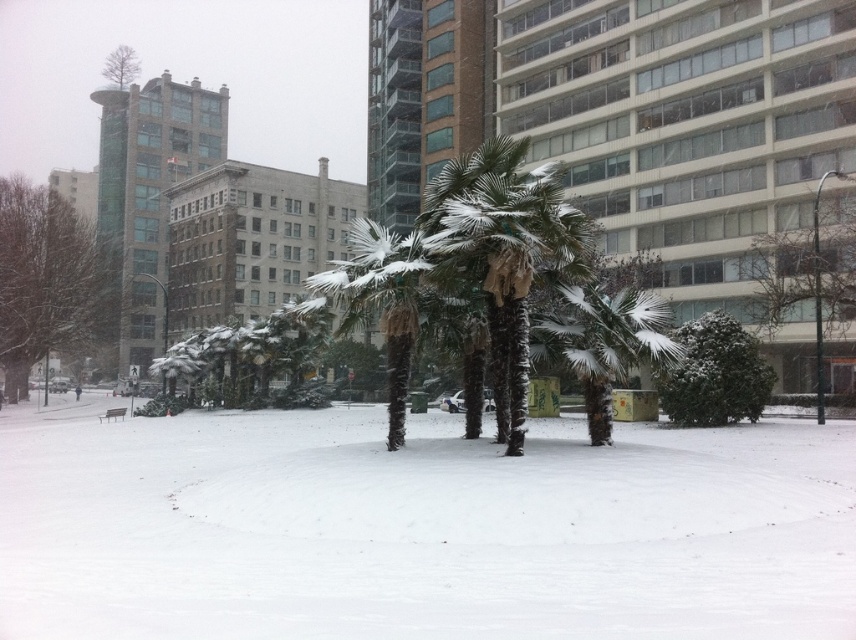
Question: Which of the following is the closest to the observer?

Choices:
 (A) (720, 378)
 (B) (518, 218)
 (C) (186, 536)

Answer: (C)

Question: Considering the relative positions of white fluffy snow at center and green leafy tree at left in the image provided, where is white fluffy snow at center located with respect to green leafy tree at left?

Choices:
 (A) left
 (B) right

Answer: (B)

Question: Among these objects, which one is farthest from the camera?

Choices:
 (A) green textured palm tree at center
 (B) green leafy tree at left
 (C) snow-covered palm trees at center

Answer: (B)

Question: Can you confirm if snow-covered palm trees at center is thinner than bare wood tree at upper left?

Choices:
 (A) yes
 (B) no

Answer: (A)

Question: Where is snow-covered palm trees at center located in relation to green textured bush at center in the image?

Choices:
 (A) above
 (B) below

Answer: (A)

Question: Among these points, which one is nearest to the camera?

Choices:
 (A) click(62, 582)
 (B) click(761, 406)
 (C) click(467, 204)
 (D) click(114, 67)

Answer: (A)